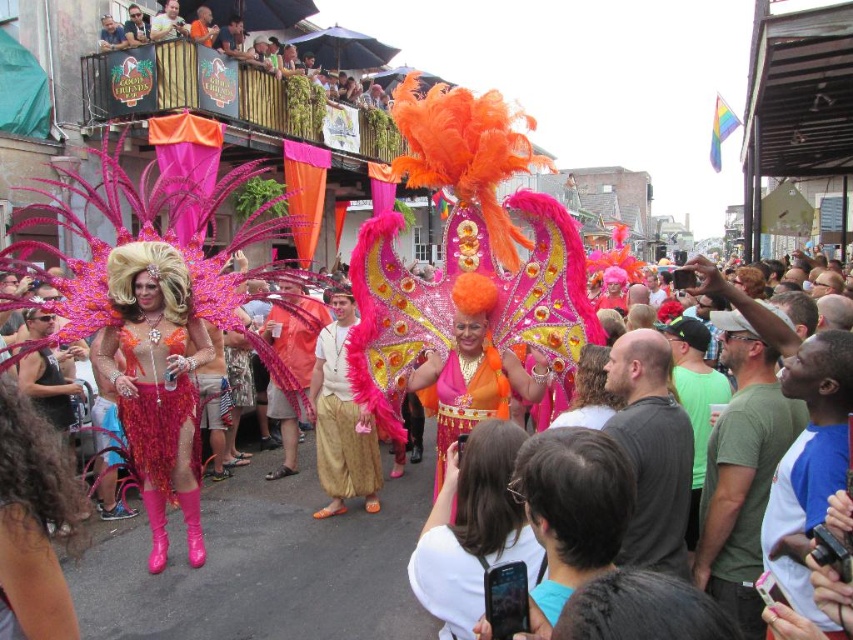
Measure the distance between shiny sequined dress at center and camera.

shiny sequined dress at center and camera are 158.12 feet apart from each other.

Is shiny sequined dress at center wider than orange sequined dress at center?

In fact, shiny sequined dress at center might be narrower than orange sequined dress at center.

The image size is (853, 640). What do you see at coordinates (157, 381) in the screenshot?
I see `shiny sequined dress at center` at bounding box center [157, 381].

Find the location of a particular element. This screenshot has height=640, width=853. shiny sequined dress at center is located at coordinates (157, 381).

Where is `gold woven fabric skirt at center`? The height and width of the screenshot is (640, 853). gold woven fabric skirt at center is located at coordinates [x=341, y=424].

Which is more to the right, gold woven fabric skirt at center or shiny sequined skirt at center?

From the viewer's perspective, gold woven fabric skirt at center appears more on the right side.

Which is in front, point (347, 424) or point (186, 333)?

Point (186, 333)

Where is `gold woven fabric skirt at center`? gold woven fabric skirt at center is located at coordinates (341, 424).

Between point (161, 484) and point (306, 308), which one is positioned in front?

Point (161, 484)

Which is more to the left, shiny sequined skirt at center or orange sequined headdress at center?

shiny sequined skirt at center

Between point (160, 468) and point (305, 349), which one is positioned behind?

The point (305, 349) is behind.

Locate an element on the screen. The height and width of the screenshot is (640, 853). shiny sequined skirt at center is located at coordinates (158, 428).